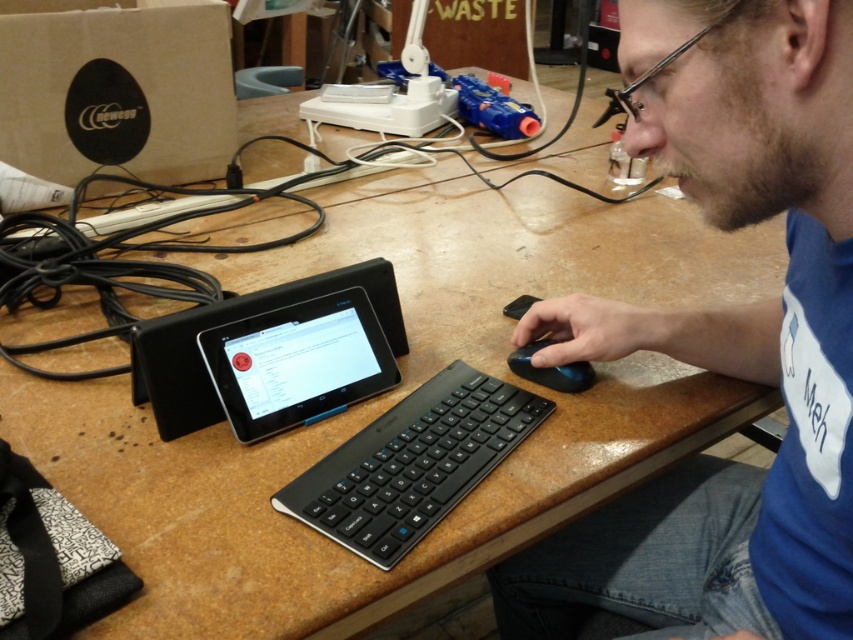
You are setting up a new wireless mouse and need to place it next to the black matte keyboard at center. According to the workspace layout, where should you position the mouse relative to the keyboard?

The black matte keyboard at center is located at point (x=412, y=464). Since the mouse is typically placed near the right hand of the user, you should position the mouse to the right of the keyboard.

You are setting up your desk and want to place both the black matte keyboard at center and the black glossy tablet at center so that they are aligned properly. According to the image, which one should be placed closer to you?

The black matte keyboard at center should be placed closer to you because it is positioned in front of the black glossy tablet at center in the image.

You need to place a wireless charger for the mouse on the desk. The charger must be placed within 10 cm of the black matte keyboard at center. Where should you position the charger relative to the keyboard?

The charger should be placed within 10 cm of the black matte keyboard at center, so position it close to the keyboard but not exceeding the 10 cm distance.